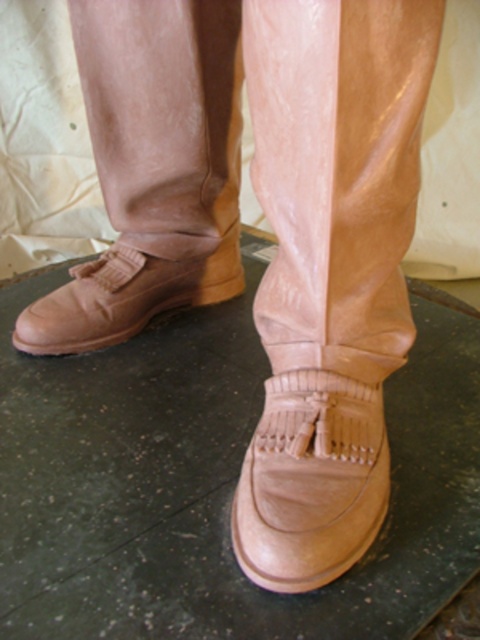
You need to choose between the matte tan boot at lower left and the leather boot at lower center for a hiking trip. Which one would provide better ankle support based on their height?

The matte tan boot at lower left is taller than the leather boot at lower center, so it would provide better ankle support for the hiking trip.

You are a photographer trying to capture a detailed shot of the matte tan boot at lower left. The camera is currently positioned 36.99 inches away from the boot. If you want to ensure the boot fills the frame without distortion, should you move closer or farther away?

Since the camera is 36.99 inches away from the matte tan boot at lower left, you should move closer to fill the frame without distortion.